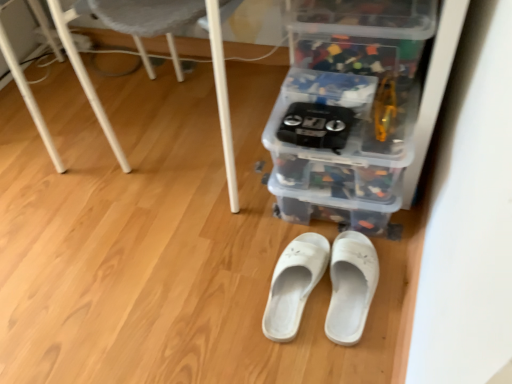
Question: Looking at the image, does white fabric slipper at center, which is the first footwear from right to left, seem bigger or smaller compared to white plastic chair at lower center?

Choices:
 (A) big
 (B) small

Answer: (B)

Question: Would you say white fabric slipper at center, the 2th footwear positioned from the left, is to the left or to the right of white plastic chair at lower center in the picture?

Choices:
 (A) left
 (B) right

Answer: (B)

Question: Estimate the real-world distances between objects in this image. Which object is closer to the transparent plastic storage box at center, which is the second storage box in top-to-bottom order?

Choices:
 (A) white fabric slippers at center, the 1th footwear from the left
 (B) translucent plastic storage box at center, the 1th storage box in the top-to-bottom sequence
 (C) white fabric slipper at center, which is the first footwear from right to left
 (D) clear plastic storage box at center, which ranks as the third storage box in top-to-bottom order
 (E) white plastic chair at lower center

Answer: (D)

Question: Which is farther from the transparent plastic storage box at center, the 2th storage box positioned from the bottom?

Choices:
 (A) translucent plastic storage box at center, the 3th storage box in the bottom-to-top sequence
 (B) white fabric slipper at center, which is the first footwear from right to left
 (C) clear plastic storage box at center, which is the first storage box in bottom-to-top order
 (D) white plastic chair at lower center
 (E) white fabric slippers at center, the 1th footwear from the left

Answer: (D)